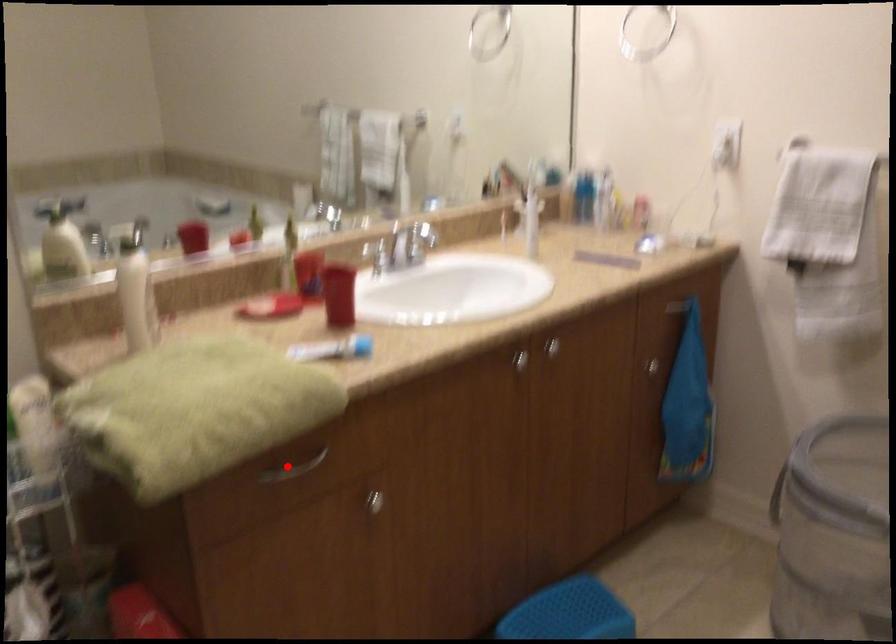
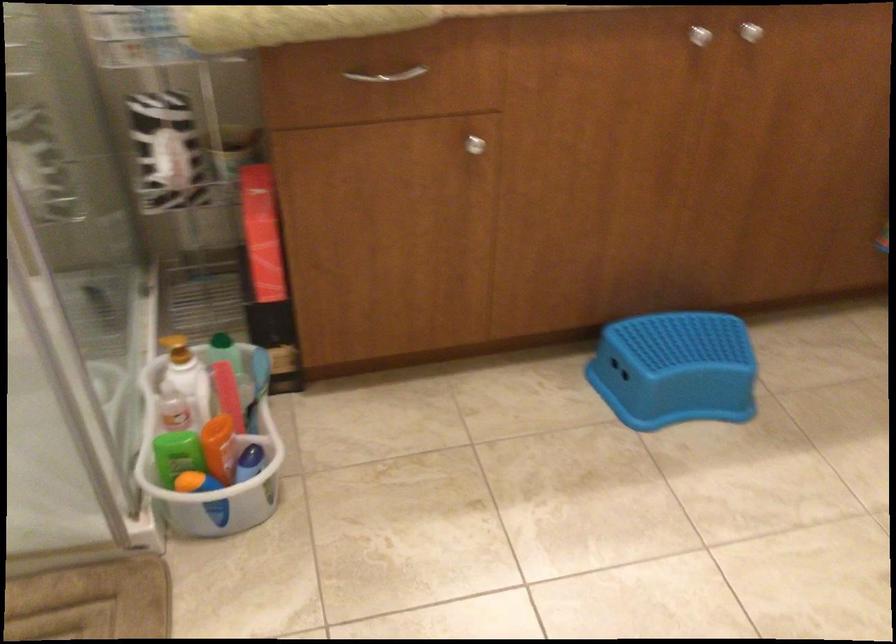
Where in the second image is the point corresponding to the highlighted location from the first image?

(386, 75)